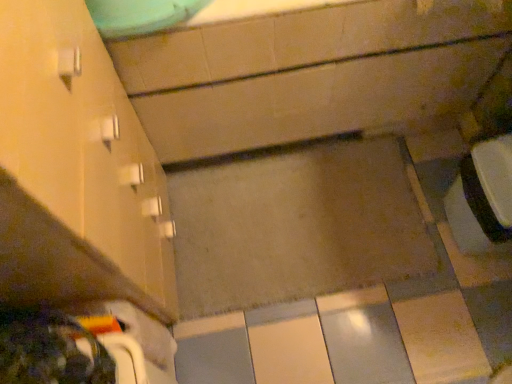
What do you see at coordinates (307, 74) in the screenshot?
I see `matte ceramic bathtub at center` at bounding box center [307, 74].

I want to click on matte ceramic bathtub at center, so click(307, 74).

What do you see at coordinates (84, 143) in the screenshot? I see `matte white cabinet at left` at bounding box center [84, 143].

In order to face matte white cabinet at left, should I rotate leftwards or rightwards?

Rotate left and turn 26.064 degrees.

Locate an element on the screen. Image resolution: width=512 pixels, height=384 pixels. matte white cabinet at left is located at coordinates (84, 143).

Identify the location of matte ceramic bathtub at center. (307, 74).

Which object is positioned more to the right, matte white cabinet at left or matte ceramic bathtub at center?

matte ceramic bathtub at center.

Who is more distant, matte white cabinet at left or matte ceramic bathtub at center?

Positioned behind is matte ceramic bathtub at center.

Is point (24, 33) closer or farther from the camera than point (201, 104)?

Clearly, point (24, 33) is closer to the camera than point (201, 104).

From the image's perspective, does matte white cabinet at left appear higher than matte ceramic bathtub at center?

Incorrect, from the image's perspective, matte white cabinet at left is lower than matte ceramic bathtub at center.

From a real-world perspective, who is located lower, matte white cabinet at left or matte ceramic bathtub at center?

From a 3D spatial view, matte ceramic bathtub at center is below.

Does matte white cabinet at left have a lesser width compared to matte ceramic bathtub at center?

Yes, matte white cabinet at left is thinner than matte ceramic bathtub at center.

Is matte white cabinet at left taller than matte ceramic bathtub at center?

Yes.

Is matte white cabinet at left bigger or smaller than matte ceramic bathtub at center?

Clearly, matte white cabinet at left is smaller in size than matte ceramic bathtub at center.

Which is correct: matte white cabinet at left is inside matte ceramic bathtub at center, or outside of it?

matte white cabinet at left is not enclosed by matte ceramic bathtub at center.

Is matte white cabinet at left placed right next to matte ceramic bathtub at center?

matte white cabinet at left and matte ceramic bathtub at center are not in contact.

Is matte white cabinet at left facing away from matte ceramic bathtub at center?

That's not correct — matte white cabinet at left is not looking away from matte ceramic bathtub at center.

Where is `bath that appears behind the matte white cabinet at left`? The width and height of the screenshot is (512, 384). bath that appears behind the matte white cabinet at left is located at coordinates (307, 74).

Considering the relative positions of matte ceramic bathtub at center and matte white cabinet at left in the image provided, is matte ceramic bathtub at center to the left or to the right of matte white cabinet at left?

Based on their positions, matte ceramic bathtub at center is located to the right of matte white cabinet at left.

Relative to matte white cabinet at left, is matte ceramic bathtub at center in front or behind?

matte ceramic bathtub at center is positioned farther from the viewer than matte white cabinet at left.

Consider the image. Which is closer, (287, 31) or (94, 111)?

The point (94, 111) is in front.

From the image's perspective, is matte ceramic bathtub at center above or below matte white cabinet at left?

From the image's perspective, matte ceramic bathtub at center appears above matte white cabinet at left.

Looking at this image, from a real-world perspective, is matte ceramic bathtub at center below matte white cabinet at left?

Yes, from a real-world perspective, matte ceramic bathtub at center is under matte white cabinet at left.

Which object is thinner, matte ceramic bathtub at center or matte white cabinet at left?

Thinner between the two is matte white cabinet at left.

Considering the sizes of matte ceramic bathtub at center and matte white cabinet at left in the image, is matte ceramic bathtub at center taller or shorter than matte white cabinet at left?

In the image, matte ceramic bathtub at center appears to be shorter than matte white cabinet at left.

Who is smaller, matte ceramic bathtub at center or matte white cabinet at left?

matte white cabinet at left.

Is matte ceramic bathtub at center located outside matte white cabinet at left?

Yes, matte ceramic bathtub at center is not within matte white cabinet at left.

Would you consider matte ceramic bathtub at center to be distant from matte white cabinet at left?

That's not correct — matte ceramic bathtub at center is a little close to matte white cabinet at left.

Is matte ceramic bathtub at center turned away from matte white cabinet at left?

No.

How different are the orientations of matte ceramic bathtub at center and matte white cabinet at left in degrees?

89.8 degrees separate the facing orientations of matte ceramic bathtub at center and matte white cabinet at left.

Measure the distance between matte ceramic bathtub at center and matte white cabinet at left.

15.21 inches.

The image size is (512, 384). Find the location of `cabinetry lying on the left of matte ceramic bathtub at center`. cabinetry lying on the left of matte ceramic bathtub at center is located at coordinates (84, 143).

The image size is (512, 384). I want to click on bath behind the matte white cabinet at left, so click(307, 74).

I want to click on bath below the matte white cabinet at left (from a real-world perspective), so click(x=307, y=74).